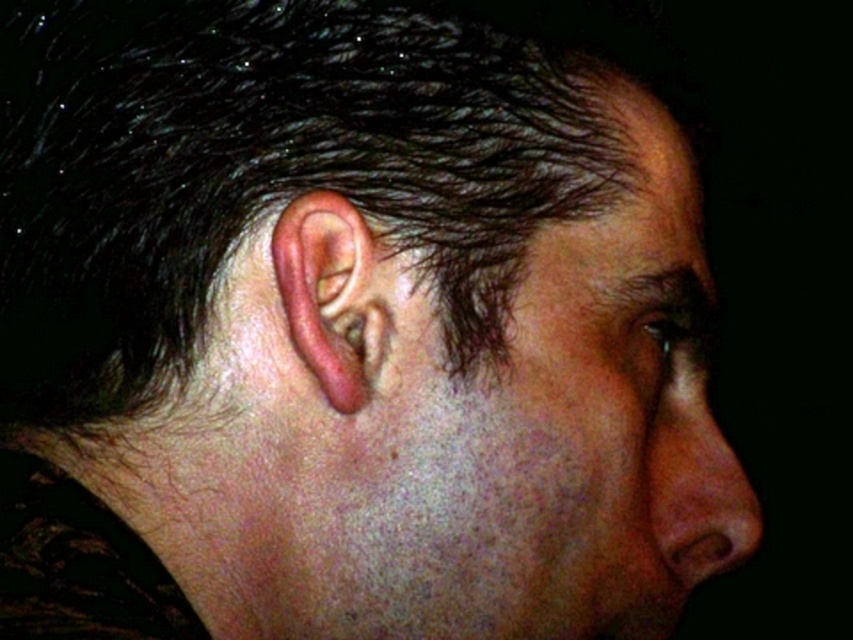
You are a photographer adjusting the focus on a closeup portrait. You notice two points in the image labeled as point (372, 305) and point (744, 550). Which point should you focus on first if you want to ensure the earlobe is sharp?

Point (372, 305) is in front of point (744, 550), so focusing on point (372, 305) first will ensure the earlobe is sharp since it is closer to the camera.